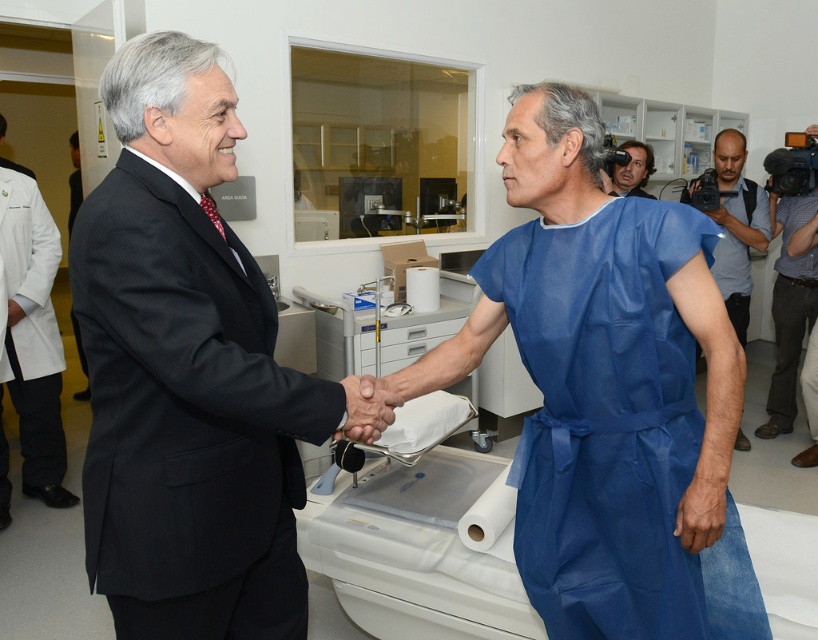
You are observing a formal handshake between two people in a medical setting. There are two individuals wearing blue scrubs at center and blue scrubs at right. Which one is positioned to the left of the other?

The blue scrubs at center is positioned to the left of the blue scrubs at right.

You are a healthcare worker who needs to quickly access both the blue scrubs at right and the blue fabric gown at center. Given their positions, can you reach both items without moving more than 18 inches from your current position?

The blue scrubs at right is 16.88 inches away from blue fabric gown at center. Since the distance between them is less than 18 inches, you can reach both items without moving more than 18 inches from your current position.